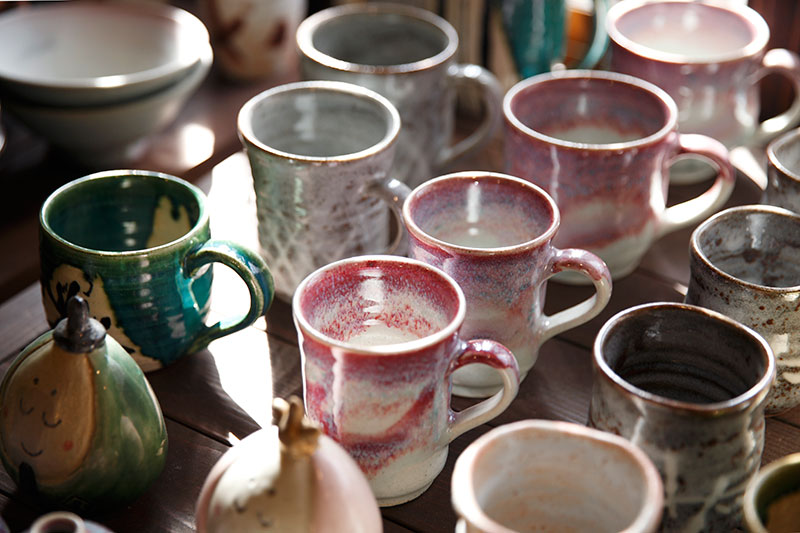
The image size is (800, 533). Identify the location of mug handles. (250, 290), (390, 191), (478, 79), (590, 55), (782, 64), (720, 154), (598, 269), (510, 368).